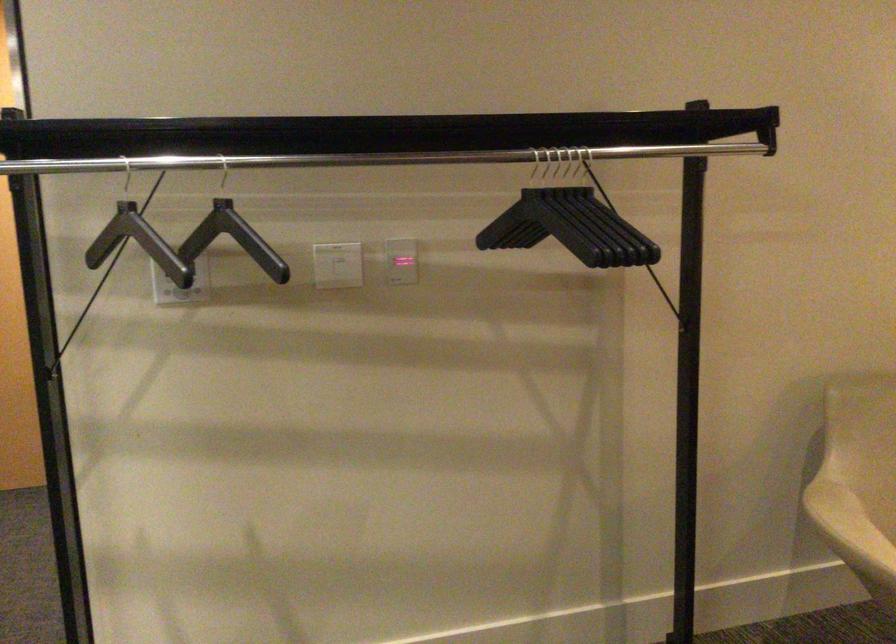
Where would you insert the glowing card slot? Please return your answer as a coordinate pair (x, y).

(401, 261)